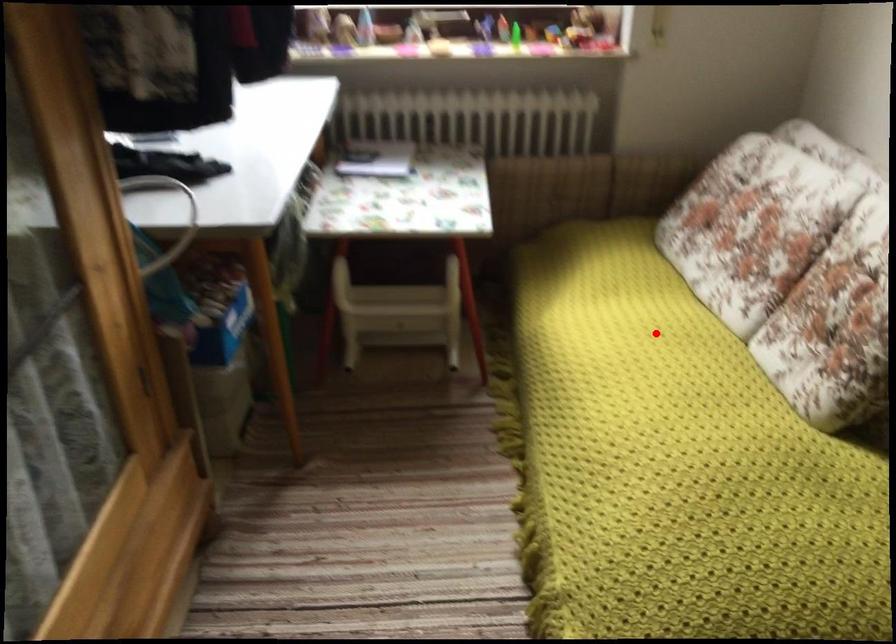
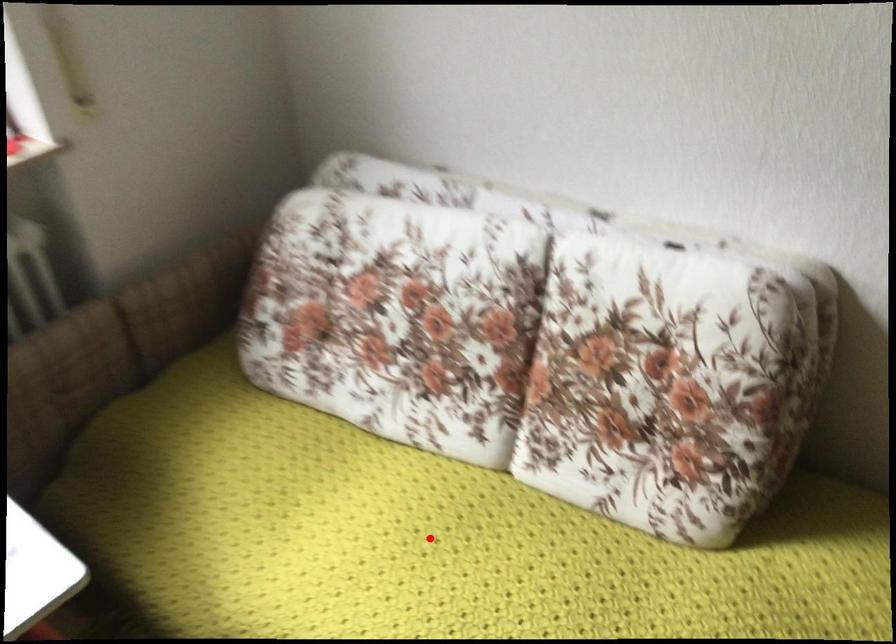
I am providing you with two images of the same scene from different viewpoints. A red point is marked on the first image and another point is marked on the second image. Is the marked point in image1 the same physical position as the marked point in image2?

Yes